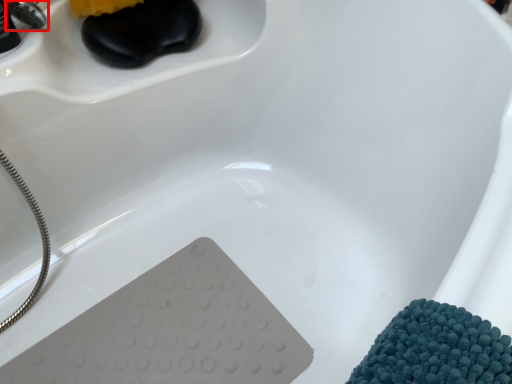
Question: In this image, where is faucet (annotated by the red box) located relative to faucet?

Choices:
 (A) left
 (B) right

Answer: (B)